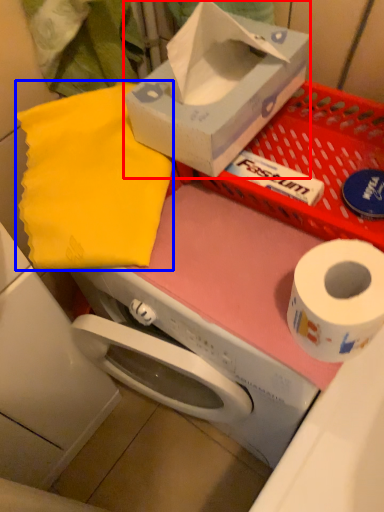
Question: Which object appears farthest to the camera in this image, box (highlighted by a red box) or cloth (highlighted by a blue box)?

Choices:
 (A) box
 (B) cloth

Answer: (B)